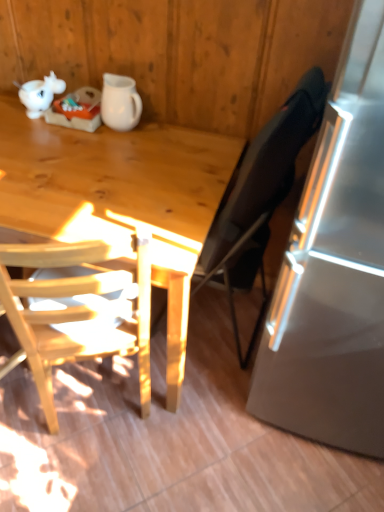
Question: Is light wood desk at left at the left side of light wood chair at left, arranged as the 2th chair when viewed from the right?

Choices:
 (A) no
 (B) yes

Answer: (B)

Question: From the image's perspective, would you say light wood desk at left is shown under light wood chair at left, arranged as the 2th chair when viewed from the right?

Choices:
 (A) no
 (B) yes

Answer: (A)

Question: Can you confirm if light wood desk at left is positioned to the right of light wood chair at left, arranged as the 2th chair when viewed from the right?

Choices:
 (A) yes
 (B) no

Answer: (B)

Question: Is light wood desk at left further to camera compared to light wood chair at left, arranged as the 2th chair when viewed from the right?

Choices:
 (A) yes
 (B) no

Answer: (A)

Question: From the image's perspective, is light wood desk at left located above light wood chair at left, arranged as the 2th chair when viewed from the right?

Choices:
 (A) yes
 (B) no

Answer: (A)

Question: Is light wood desk at left in contact with light wood chair at left, positioned as the 1th chair in left-to-right order?

Choices:
 (A) yes
 (B) no

Answer: (B)

Question: Is light wood chair at left, positioned as the 1th chair in left-to-right order, facing towards white matte pitcher at upper center?

Choices:
 (A) yes
 (B) no

Answer: (A)

Question: From the image's perspective, does light wood chair at left, positioned as the 1th chair in left-to-right order, appear lower than white matte pitcher at upper center?

Choices:
 (A) yes
 (B) no

Answer: (A)

Question: From the image's perspective, is light wood chair at left, positioned as the 1th chair in left-to-right order, located above white matte pitcher at upper center?

Choices:
 (A) yes
 (B) no

Answer: (B)

Question: Is light wood chair at left, positioned as the 1th chair in left-to-right order, in front of white matte pitcher at upper center?

Choices:
 (A) yes
 (B) no

Answer: (A)

Question: Can you confirm if light wood chair at left, positioned as the 1th chair in left-to-right order, is shorter than white matte pitcher at upper center?

Choices:
 (A) yes
 (B) no

Answer: (B)

Question: From a real-world perspective, is light wood chair at left, positioned as the 1th chair in left-to-right order, on white matte pitcher at upper center?

Choices:
 (A) no
 (B) yes

Answer: (A)

Question: Does light wood chair at left, positioned as the 1th chair in left-to-right order, come behind black fabric chair at right, which is counted as the first chair, starting from the right?

Choices:
 (A) no
 (B) yes

Answer: (A)